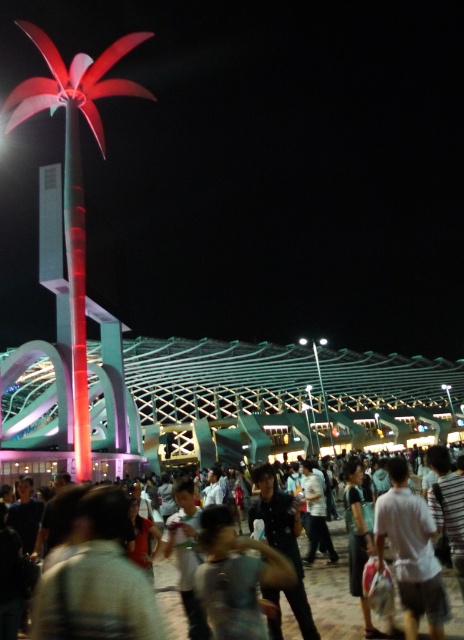
You are a photographer trying to capture the shiny metallic palm tree at left and the matte black crowd at center in a single shot. Based on their positions, which object would appear closer to the camera in the photo?

The shiny metallic palm tree at left appears closer to the camera because it is positioned over the matte black crowd at center, indicating it is in a forward layer.

Looking at this image, you are attending a night event and see the shiny metallic palm tree at left and the matte black crowd at center. Which object is located to the left of the other?

The shiny metallic palm tree at left is positioned on the left side of matte black crowd at center.

Consider the image. You are a photographer trying to capture a clear shot of the white matte shirt at lower right without the matte black crowd at center obstructing it. Based on the scene, is this possible?

The white matte shirt at lower right is in front of the matte black crowd at center, so it is already positioned in a way that it is not obstructed by the crowd. Therefore, you can capture a clear shot of the white matte shirt at lower right without the matte black crowd at center blocking it.